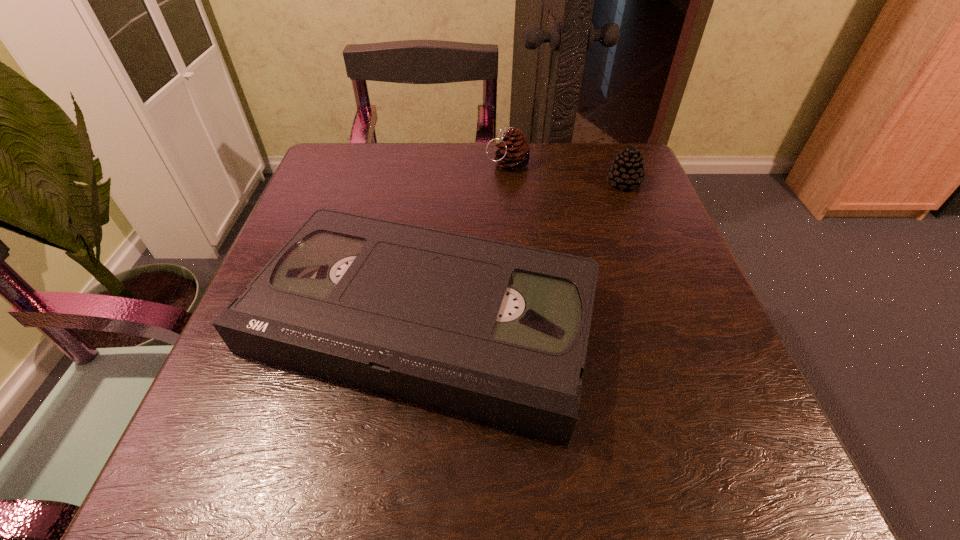
What are the coordinates of `the left pinecone` in the screenshot? It's located at point(514,150).

You are a GUI agent. You are given a task and a screenshot of the screen. Output one action in this format:
    pyautogui.click(x=<x>, y=<y>)
    Task: Click on the right pinecone
    
    Given the screenshot: What is the action you would take?
    (x=627, y=170)

The width and height of the screenshot is (960, 540). I want to click on the nearest object, so click(498, 332).

The image size is (960, 540). I want to click on videotape, so point(498,332).

I want to click on free space located 0.240m with a leaf charm attached to the left pinecone, so click(387, 164).

Where is `vacant space situated with a leaf charm attached to the left pinecone`? This screenshot has width=960, height=540. vacant space situated with a leaf charm attached to the left pinecone is located at coordinates (322, 164).

In order to click on free spot located with a leaf charm attached to the left pinecone in this screenshot , I will do `click(359, 164)`.

This screenshot has height=540, width=960. Find the location of `vacant area situated 0.060m at the narrow end of the rightmost object`. vacant area situated 0.060m at the narrow end of the rightmost object is located at coordinates (580, 183).

This screenshot has width=960, height=540. I want to click on vacant space located at the narrow end of the rightmost object, so click(x=471, y=183).

Locate an element on the screen. This screenshot has width=960, height=540. vacant area located at the narrow end of the rightmost object is located at coordinates (450, 183).